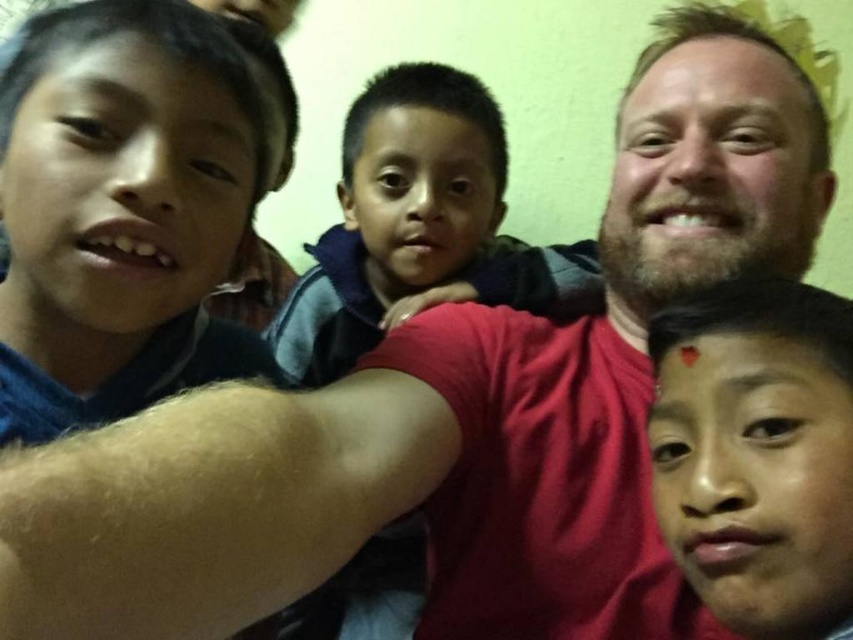
Who is taller, dark blue fleece at center or matte skin face at lower right?

dark blue fleece at center

Which is more to the left, dark blue fleece at center or matte skin face at lower right?

From the viewer's perspective, dark blue fleece at center appears more on the left side.

Does point (398, 538) lie in front of point (722, 609)?

No, (398, 538) is behind (722, 609).

Find the location of a particular element. This screenshot has width=853, height=640. dark blue fleece at center is located at coordinates (419, 227).